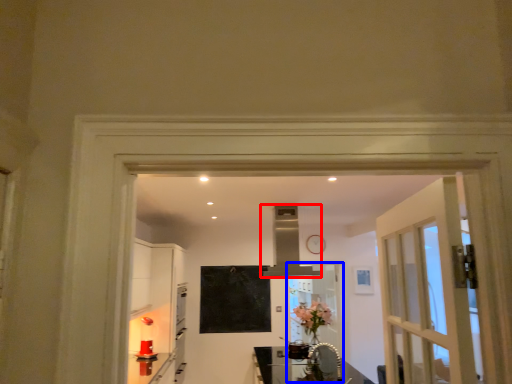
Question: Among these objects, which one is farthest to the camera, exhaust hood (highlighted by a red box) or screen door (highlighted by a blue box)?

Choices:
 (A) exhaust hood
 (B) screen door

Answer: (B)